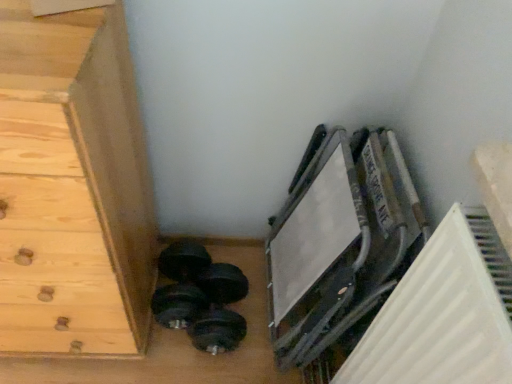
Question: Should I look upward or downward to see light wood chest of drawers at lower left?

Choices:
 (A) down
 (B) up

Answer: (A)

Question: Is light wood chest of drawers at lower left outside black rubber dumbbell at lower left?

Choices:
 (A) yes
 (B) no

Answer: (A)

Question: From the image's perspective, is light wood chest of drawers at lower left under black rubber dumbbell at lower left?

Choices:
 (A) yes
 (B) no

Answer: (B)

Question: Is light wood chest of drawers at lower left surrounding black rubber dumbbell at lower left?

Choices:
 (A) no
 (B) yes

Answer: (A)

Question: Can you confirm if light wood chest of drawers at lower left is smaller than black rubber dumbbell at lower left?

Choices:
 (A) yes
 (B) no

Answer: (B)

Question: Considering the relative sizes of light wood chest of drawers at lower left and black rubber dumbbell at lower left in the image provided, is light wood chest of drawers at lower left taller than black rubber dumbbell at lower left?

Choices:
 (A) no
 (B) yes

Answer: (B)

Question: Does light wood chest of drawers at lower left turn towards black rubber dumbbell at lower left?

Choices:
 (A) no
 (B) yes

Answer: (A)

Question: Is black rubber dumbbell at lower left bigger than light wood chest of drawers at lower left?

Choices:
 (A) yes
 (B) no

Answer: (B)

Question: Can you confirm if black rubber dumbbell at lower left is wider than light wood chest of drawers at lower left?

Choices:
 (A) yes
 (B) no

Answer: (B)

Question: Is black rubber dumbbell at lower left located outside light wood chest of drawers at lower left?

Choices:
 (A) no
 (B) yes

Answer: (B)

Question: Can light wood chest of drawers at lower left be found inside black rubber dumbbell at lower left?

Choices:
 (A) no
 (B) yes

Answer: (A)

Question: From the image's perspective, is black rubber dumbbell at lower left on light wood chest of drawers at lower left?

Choices:
 (A) no
 (B) yes

Answer: (A)

Question: Is black rubber dumbbell at lower left shorter than light wood chest of drawers at lower left?

Choices:
 (A) yes
 (B) no

Answer: (A)

Question: Is light wood chest of drawers at lower left bigger or smaller than black rubber dumbbell at lower left?

Choices:
 (A) small
 (B) big

Answer: (B)